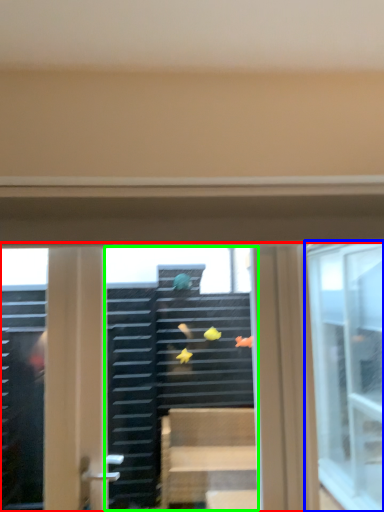
Question: Which is nearer to the window (highlighted by a red box)? window (highlighted by a blue box) or shop window (highlighted by a green box).

Choices:
 (A) window
 (B) shop window

Answer: (B)